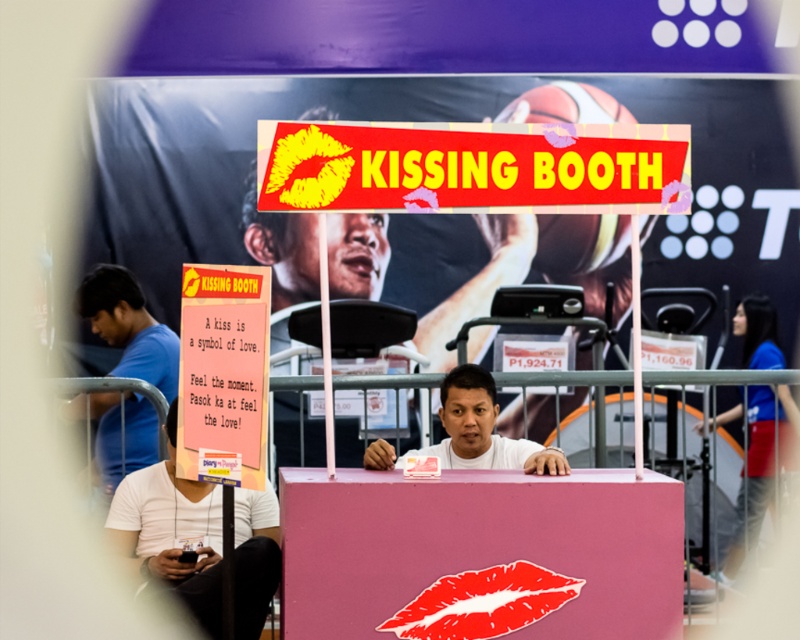
Between point (377, 230) and point (98, 278), which one is positioned in front?

Positioned in front is point (98, 278).

Does pink matte kissing booth at center have a lesser height compared to blue t-shirt at left?

Yes.

Is point (508, 252) in front of point (156, 429)?

That is False.

You are a GUI agent. You are given a task and a screenshot of the screen. Output one action in this format:
    pyautogui.click(x=<x>, y=<y>)
    Task: Click on the pink matte kissing booth at center
    The width and height of the screenshot is (800, 640).
    Given the screenshot: What is the action you would take?
    pyautogui.click(x=478, y=285)

This screenshot has width=800, height=640. What do you see at coordinates (172, 536) in the screenshot?
I see `white matte shirt at center` at bounding box center [172, 536].

Where is `white matte shirt at center`? The height and width of the screenshot is (640, 800). white matte shirt at center is located at coordinates (172, 536).

Which of these two, blue t-shirt at left or white matte man at center, stands taller?

With more height is blue t-shirt at left.

Is point (130, 304) in front of point (448, 406)?

No, (130, 304) is behind (448, 406).

Is point (113, 324) positioned before point (452, 392)?

No, (113, 324) is further to viewer.

You are a GUI agent. You are given a task and a screenshot of the screen. Output one action in this format:
    pyautogui.click(x=<x>, y=<y>)
    Task: Click on the blue t-shirt at left
    Image resolution: width=800 pixels, height=640 pixels.
    Given the screenshot: What is the action you would take?
    pyautogui.click(x=130, y=326)